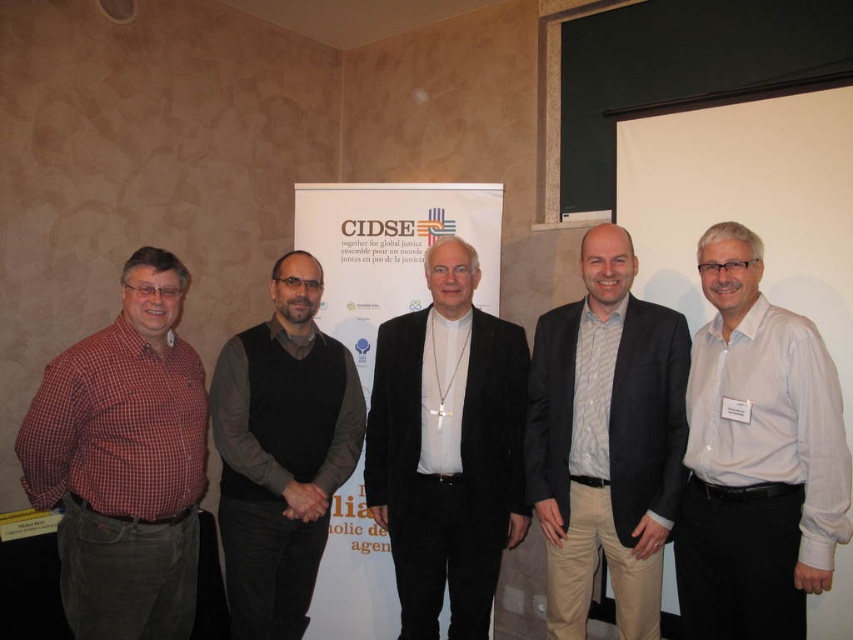
What is the exact position of the red checkered shirt at left in the image?

The red checkered shirt at left is located at point (125, 461).

You are a photographer at the event and need to adjust the lighting so that the light beige cotton pants at center and dark gray sweater at center are evenly illuminated. Since one is taller than the other, which one requires the taller light stand to ensure proper coverage?

The dark gray sweater at center requires the taller light stand because it is taller than the light beige cotton pants at center.

Based on the scene description, which object is thinner between the white shirt at center and the light beige cotton pants at center?

The white shirt at center is thinner than the light beige cotton pants at center.